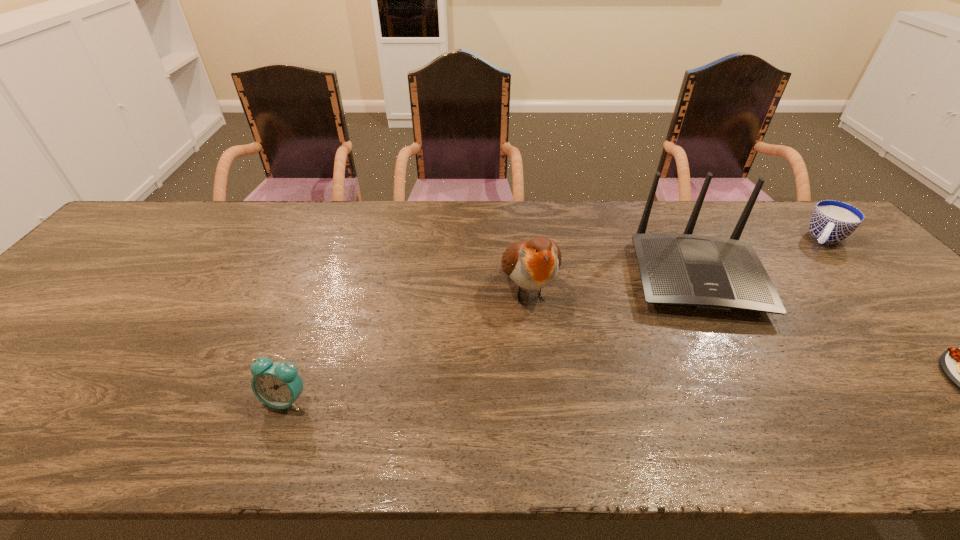
Point out which object is positioned as the third nearest to the alarm clock. Please provide its 2D coordinates. Your answer should be formatted as a tuple, i.e. [(x, y)], where the tuple contains the x and y coordinates of a point satisfying the conditions above.

[(959, 365)]